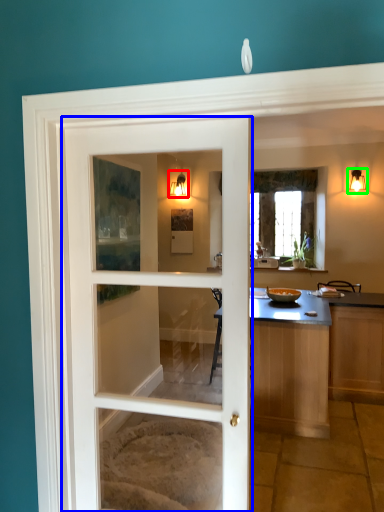
Question: Which object is positioned closest to light fixture (highlighted by a red box)? Select from door (highlighted by a blue box) and light fixture (highlighted by a green box).

Choices:
 (A) door
 (B) light fixture

Answer: (B)